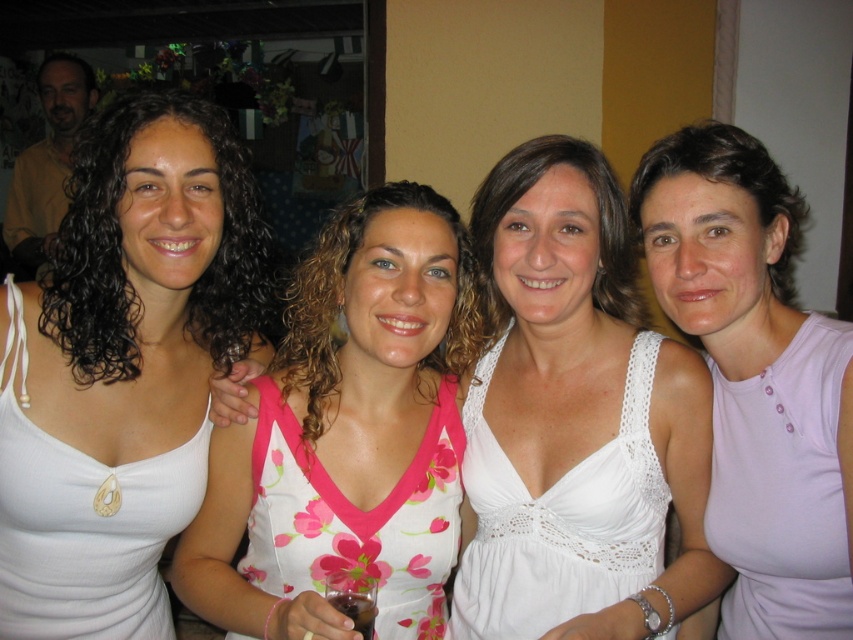
Between pink fabric tank top at right and white floral fabric dress at center, which one appears on the left side from the viewer's perspective?

From the viewer's perspective, white floral fabric dress at center appears more on the left side.

Who is positioned more to the right, pink fabric tank top at right or white floral fabric dress at center?

From the viewer's perspective, pink fabric tank top at right appears more on the right side.

What do you see at coordinates (782, 490) in the screenshot?
I see `pink fabric tank top at right` at bounding box center [782, 490].

Find the location of a particular element. The height and width of the screenshot is (640, 853). pink fabric tank top at right is located at coordinates coord(782,490).

Who is taller, pink floral dress at center or floral fabric dress at center?

With more height is pink floral dress at center.

Does point (521, 417) lie behind point (346, 260)?

Yes, point (521, 417) is behind point (346, 260).

The image size is (853, 640). What do you see at coordinates (578, 417) in the screenshot?
I see `pink floral dress at center` at bounding box center [578, 417].

Locate an element on the screen. The image size is (853, 640). pink floral dress at center is located at coordinates (578, 417).

Measure the distance between point (x=241, y=602) and camera.

A distance of 1.10 meters exists between point (x=241, y=602) and camera.

Is point (398, 300) positioned in front of point (590, 502)?

Yes, it is in front of point (590, 502).

Find the location of a particular element. This screenshot has width=853, height=640. floral fabric dress at center is located at coordinates (347, 436).